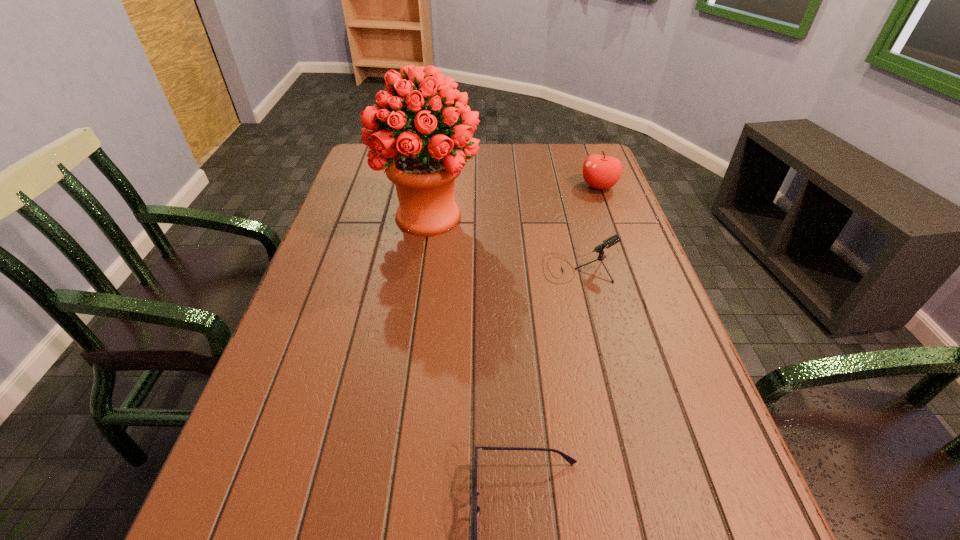
This screenshot has height=540, width=960. Identify the location of bouquet. (423, 164).

Identify the location of apple. (602, 172).

Find the location of a particular element. This screenshot has width=960, height=540. the second nearest object is located at coordinates [x=616, y=238].

Where is `vacant area located on the front of the tallest object`? vacant area located on the front of the tallest object is located at coordinates (410, 347).

The width and height of the screenshot is (960, 540). What are the coordinates of `free space located on the left of the apple` in the screenshot? It's located at (521, 186).

Where is `free space located 0.070m on the stand of the microphone`? free space located 0.070m on the stand of the microphone is located at coordinates (515, 268).

The width and height of the screenshot is (960, 540). Identify the location of vacant area located 0.310m on the stand of the microphone. (417, 268).

This screenshot has width=960, height=540. I want to click on vacant region located on the stand of the microphone, so click(x=379, y=268).

This screenshot has height=540, width=960. I want to click on object that is at the far edge, so point(602,172).

At what (x,y) coordinates should I click in order to perform the action: click on object located in the left edge section of the desktop. Please return your answer as a coordinate pair (x, y). The image size is (960, 540). Looking at the image, I should click on (423, 164).